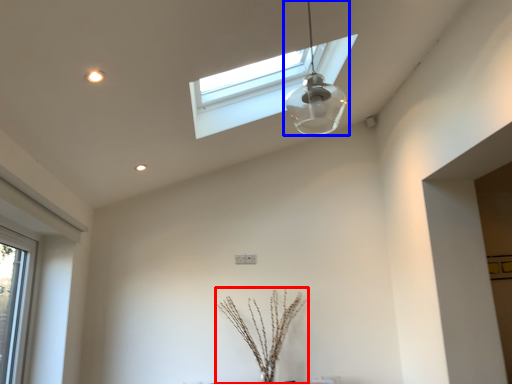
Question: Which point is further to the camera, plant (highlighted by a red box) or lamp (highlighted by a blue box)?

Choices:
 (A) plant
 (B) lamp

Answer: (A)